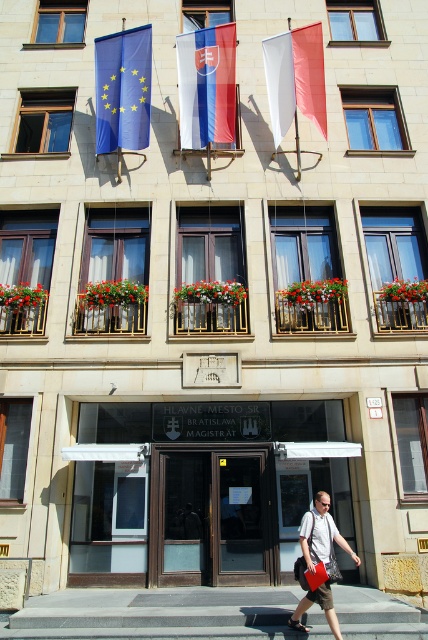
Question: Which point is farther to the camera?

Choices:
 (A) gray concrete stairs at center
 (B) white matte flag at upper center
 (C) matte gray shirt at center

Answer: (B)

Question: Does gray concrete stairs at center have a lesser width compared to matte gray shirt at center?

Choices:
 (A) no
 (B) yes

Answer: (A)

Question: Can you confirm if white fabric flag at center is smaller than matte gray shirt at center?

Choices:
 (A) no
 (B) yes

Answer: (A)

Question: Which object is positioned closest to the white fabric flag at center?

Choices:
 (A) white matte flag at upper center
 (B) matte gray shirt at center
 (C) blue fabric flag at upper left

Answer: (C)

Question: Can you confirm if white fabric flag at center is bigger than matte gray shirt at center?

Choices:
 (A) yes
 (B) no

Answer: (A)

Question: Which object is positioned farthest from the gray concrete stairs at center?

Choices:
 (A) matte gray shirt at center
 (B) blue fabric flag at upper left

Answer: (B)